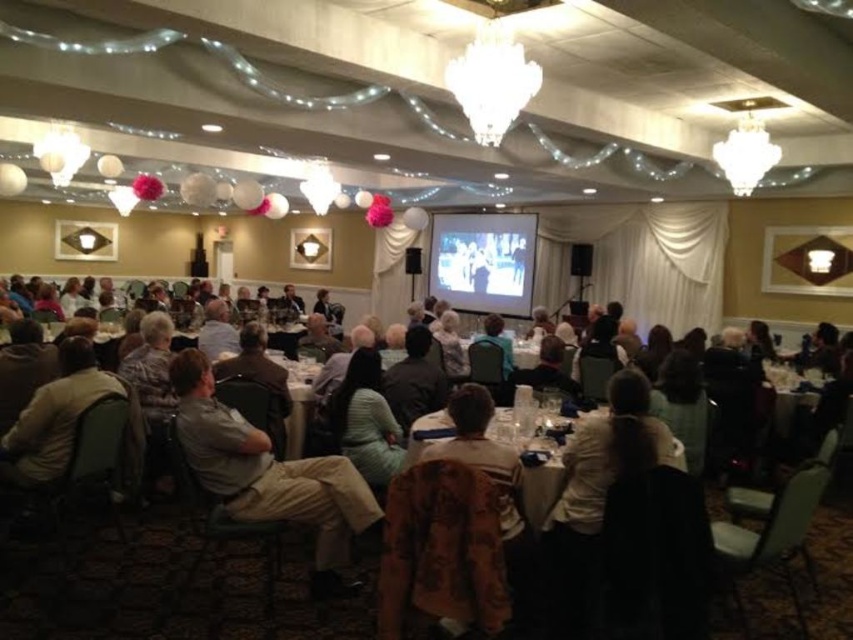
Which is above, light brown fabric shirt at center or white glossy table at center?

white glossy table at center is higher up.

Does light brown fabric shirt at center appear on the right side of white glossy table at center?

Indeed, light brown fabric shirt at center is positioned on the right side of white glossy table at center.

Does point (309, 484) lie in front of point (300, 435)?

That is True.

Find the location of `light brown fabric shirt at center`. light brown fabric shirt at center is located at coordinates (270, 474).